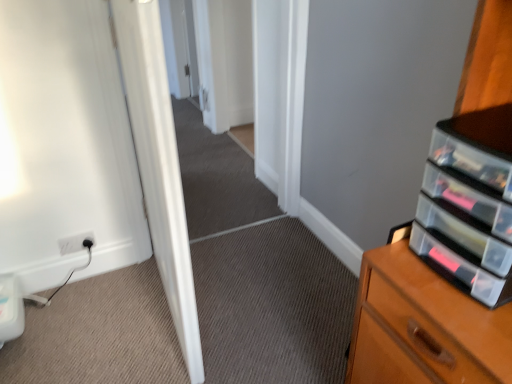
Question: Is point (66, 248) closer or farther from the camera than point (508, 198)?

Choices:
 (A) farther
 (B) closer

Answer: (A)

Question: Is white plastic electric outlet at lower left situated inside clear plastic drawers at right or outside?

Choices:
 (A) inside
 (B) outside

Answer: (B)

Question: Considering the real-world distances, which object is closest to the clear plastic drawers at right?

Choices:
 (A) white plastic electric outlet at lower left
 (B) white glossy door at center

Answer: (B)

Question: Based on their relative distances, which object is nearer to the clear plastic drawers at right?

Choices:
 (A) white glossy door at center
 (B) white plastic electric outlet at lower left

Answer: (A)